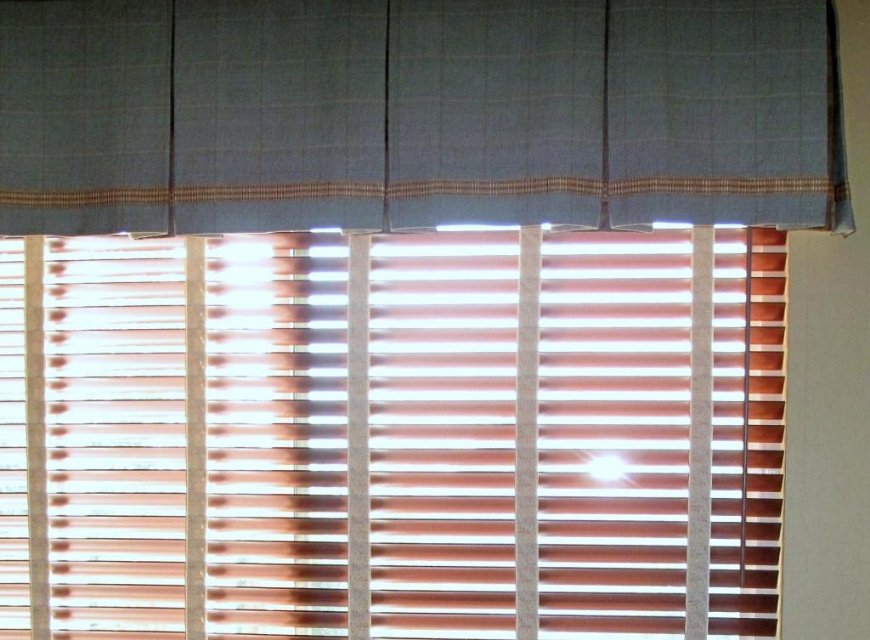
Does wooden blinds at center appear on the right side of textured gray curtain at upper center?

In fact, wooden blinds at center is to the left of textured gray curtain at upper center.

Where is `wooden blinds at center`? wooden blinds at center is located at coordinates (392, 435).

Locate an element on the screen. wooden blinds at center is located at coordinates (392, 435).